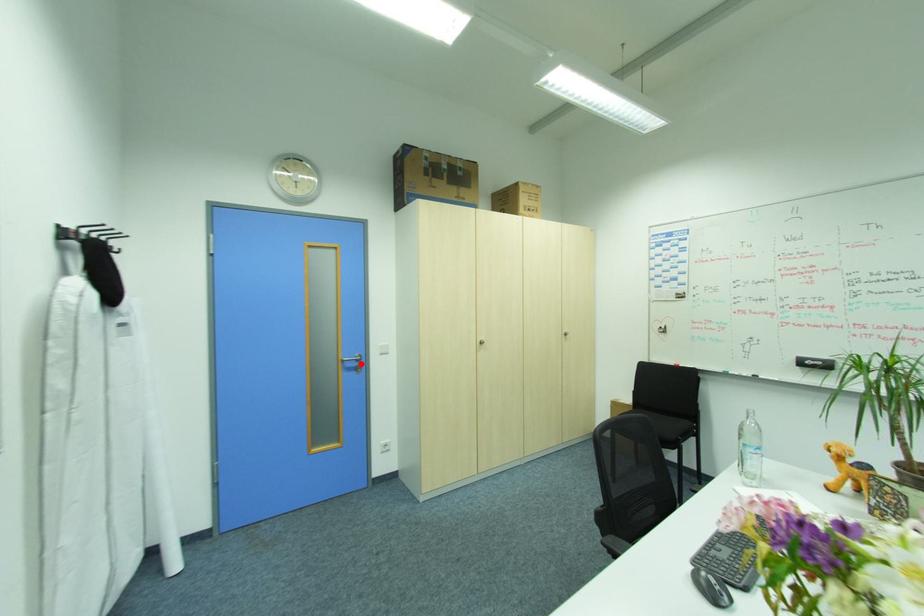
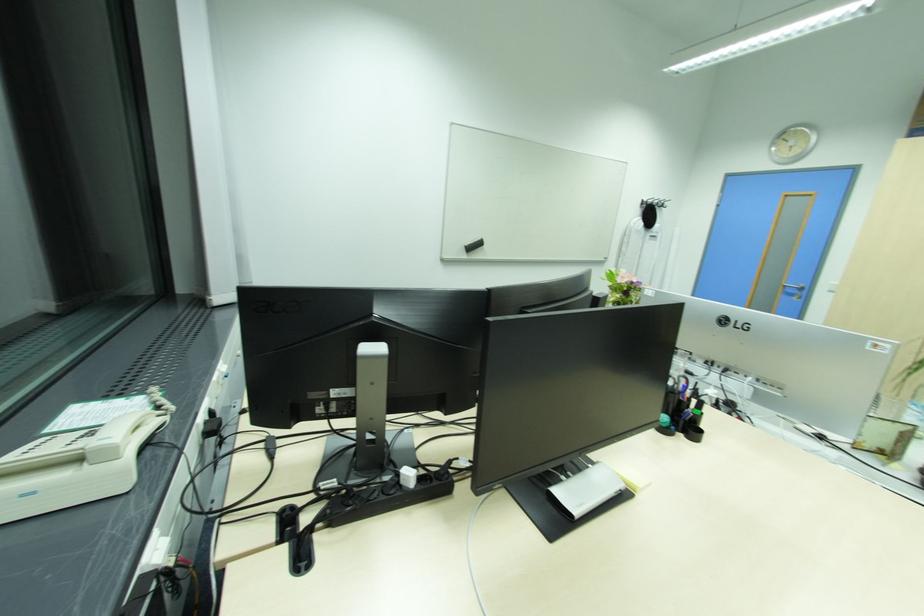
The point at the highlighted location is marked in the first image. Where is the corresponding point in the second image?

(801, 291)